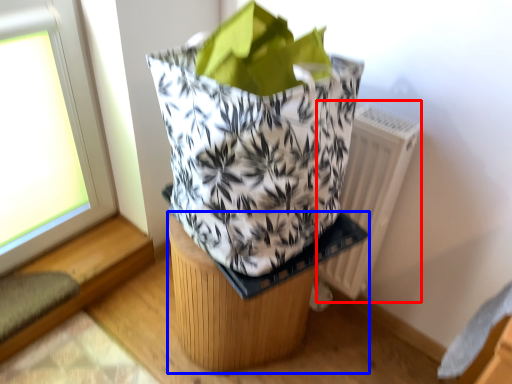
Question: Among these objects, which one is farthest to the camera, radiator (highlighted by a red box) or furniture (highlighted by a blue box)?

Choices:
 (A) radiator
 (B) furniture

Answer: (A)